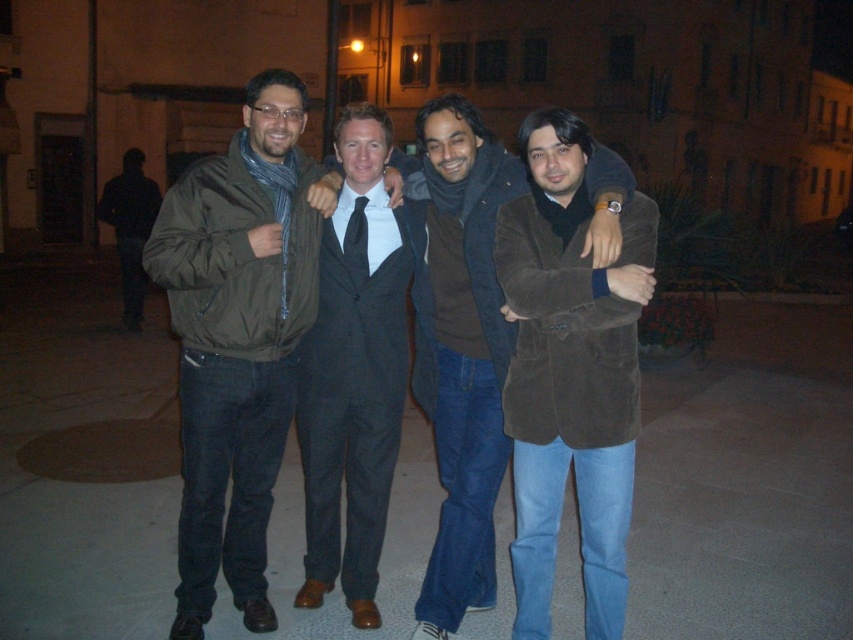
You are a photographer trying to capture the group of men in the plaza. You notice the matte olive green jacket at center and the dark brown suit at center. Which clothing item is positioned higher in the frame?

The matte olive green jacket at center is located above the dark brown suit at center, so it is positioned higher in the frame.

You are a photographer setting up a camera to capture the group of four men in the plaza. You want to ensure that both the matte olive green jacket at center and the suede coat at center are fully visible in the frame. Given their widths, which jacket requires a wider angle to accommodate its size?

The matte olive green jacket at center requires a wider angle because its width surpasses that of the suede coat at center, necessitating more space in the frame to fully capture it.